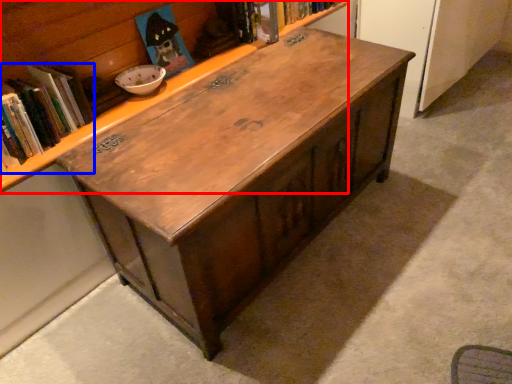
Question: Which object appears closest to the camera in this image, bookcase (highlighted by a red box) or book (highlighted by a blue box)?

Choices:
 (A) bookcase
 (B) book

Answer: (A)